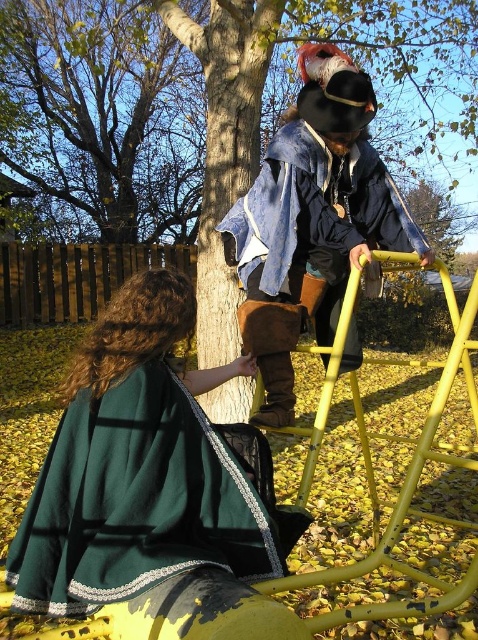
Between smooth bark tree at center and yellow metal ladder at upper right, which one appears on the right side from the viewer's perspective?

From the viewer's perspective, yellow metal ladder at upper right appears more on the right side.

Between point (60, 44) and point (473, 560), which one is positioned in front?

Point (473, 560)

Which is in front, point (15, 141) or point (328, 401)?

Point (328, 401)

This screenshot has width=478, height=640. In order to click on smooth bark tree at center in this screenshot , I will do `click(210, 109)`.

Is smooth bark tree at center to the left of green wool cape at lower left from the viewer's perspective?

Incorrect, smooth bark tree at center is not on the left side of green wool cape at lower left.

This screenshot has height=640, width=478. Describe the element at coordinates (210, 109) in the screenshot. I see `smooth bark tree at center` at that location.

This screenshot has height=640, width=478. What are the coordinates of `smooth bark tree at center` in the screenshot? It's located at (210, 109).

Find the location of a particular element. Image resolution: width=478 pixels, height=640 pixels. smooth bark tree at center is located at coordinates (210, 109).

Who is higher up, denim fabric pirate at upper center or yellow metal ladder at upper right?

denim fabric pirate at upper center is above.

How distant is denim fabric pirate at upper center from yellow metal ladder at upper right?

denim fabric pirate at upper center and yellow metal ladder at upper right are 50.54 centimeters apart.

Between point (314, 104) and point (334, 572), which one is positioned behind?

Positioned behind is point (314, 104).

Identify the location of denim fabric pirate at upper center. (319, 195).